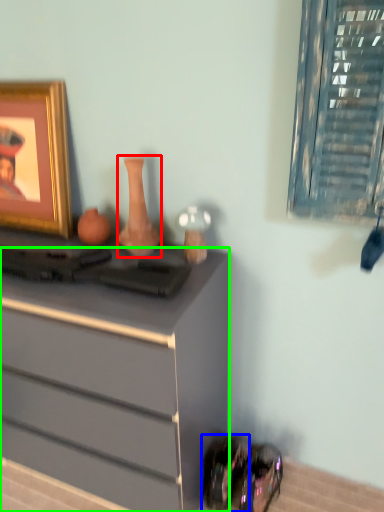
Question: Estimate the real-world distances between objects in this image. Which object is farther from vase (highlighted by a red box), shoe (highlighted by a blue box) or chest of drawers (highlighted by a green box)?

Choices:
 (A) shoe
 (B) chest of drawers

Answer: (A)